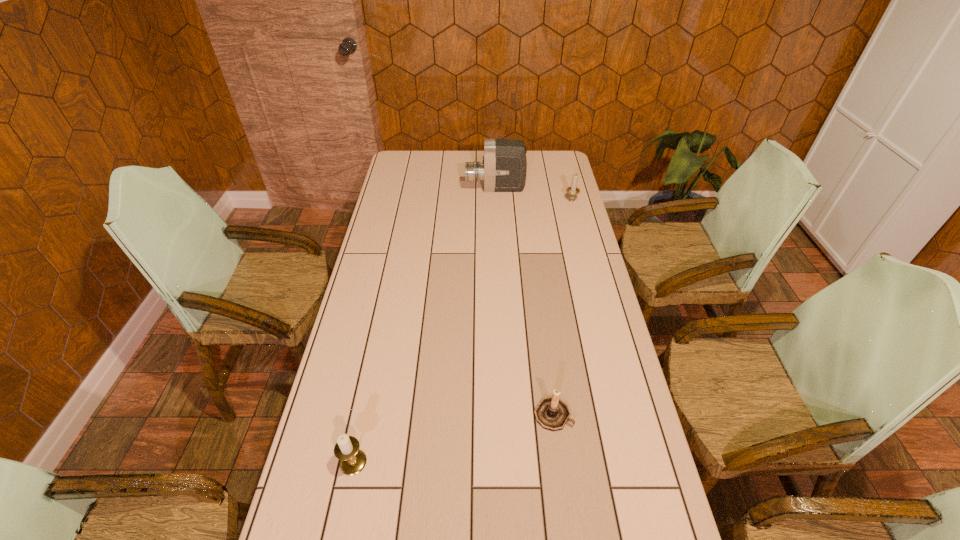
Find the location of a particular element. The image size is (960, 540). vacant area at the far left corner of the desktop is located at coordinates [418, 173].

Identify the location of blank space at the far right corner of the desktop. (540, 167).

Find the location of a particular element. This screenshot has width=960, height=540. free space between the nearest candle holder and the third farthest object is located at coordinates (453, 438).

Locate an element on the screen. vacant area that lies between the second farthest candle holder and the leftmost object is located at coordinates (453, 438).

Where is `empty location between the second farthest candle holder and the leftmost candle holder`? This screenshot has width=960, height=540. empty location between the second farthest candle holder and the leftmost candle holder is located at coordinates (453, 438).

The image size is (960, 540). I want to click on free spot between the leftmost candle holder and the second farthest candle holder, so click(x=453, y=438).

The image size is (960, 540). I want to click on free point between the farthest candle holder and the leftmost candle holder, so click(462, 331).

This screenshot has height=540, width=960. I want to click on free space between the tallest object and the farthest candle holder, so click(534, 194).

Identify the location of empty space between the farthest candle holder and the nearest object. The image size is (960, 540). (462, 331).

Find the location of a particular element. Image resolution: width=960 pixels, height=540 pixels. vacant area between the second candle holder from left to right and the rightmost candle holder is located at coordinates (563, 307).